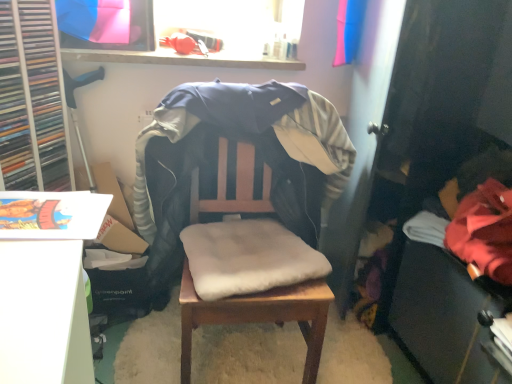
Question: Can you confirm if wooden table at center is thinner than soft beige cushion at center?

Choices:
 (A) yes
 (B) no

Answer: (B)

Question: Considering the relative positions of wooden table at center and soft beige cushion at center in the image provided, is wooden table at center to the left of soft beige cushion at center from the viewer's perspective?

Choices:
 (A) no
 (B) yes

Answer: (A)

Question: From a real-world perspective, is wooden table at center physically below soft beige cushion at center?

Choices:
 (A) yes
 (B) no

Answer: (A)

Question: Are wooden table at center and soft beige cushion at center far apart?

Choices:
 (A) no
 (B) yes

Answer: (A)

Question: Is wooden table at center bigger than soft beige cushion at center?

Choices:
 (A) no
 (B) yes

Answer: (A)

Question: In the image, is wooden table at center on the left side or the right side of wooden chair with cushion at center?

Choices:
 (A) left
 (B) right

Answer: (A)

Question: Considering the positions of wooden table at center and wooden chair with cushion at center in the image, is wooden table at center wider or thinner than wooden chair with cushion at center?

Choices:
 (A) thin
 (B) wide

Answer: (B)

Question: From the image's perspective, is wooden table at center located above or below wooden chair with cushion at center?

Choices:
 (A) above
 (B) below

Answer: (B)

Question: Does point (325, 291) appear closer or farther from the camera than point (304, 289)?

Choices:
 (A) farther
 (B) closer

Answer: (A)

Question: In the image, is red fleece jacket at lower right positioned in front of or behind wooden chair with cushion at center?

Choices:
 (A) front
 (B) behind

Answer: (B)

Question: Choose the correct answer: Is red fleece jacket at lower right inside wooden chair with cushion at center or outside it?

Choices:
 (A) inside
 (B) outside

Answer: (B)

Question: From the image's perspective, is red fleece jacket at lower right above or below wooden chair with cushion at center?

Choices:
 (A) below
 (B) above

Answer: (B)

Question: Looking at the image, does red fleece jacket at lower right seem bigger or smaller compared to wooden chair with cushion at center?

Choices:
 (A) big
 (B) small

Answer: (B)

Question: Would you say soft beige cushion at center is to the left or to the right of wooden chair with cushion at center in the picture?

Choices:
 (A) left
 (B) right

Answer: (A)

Question: Is soft beige cushion at center bigger or smaller than wooden chair with cushion at center?

Choices:
 (A) big
 (B) small

Answer: (B)